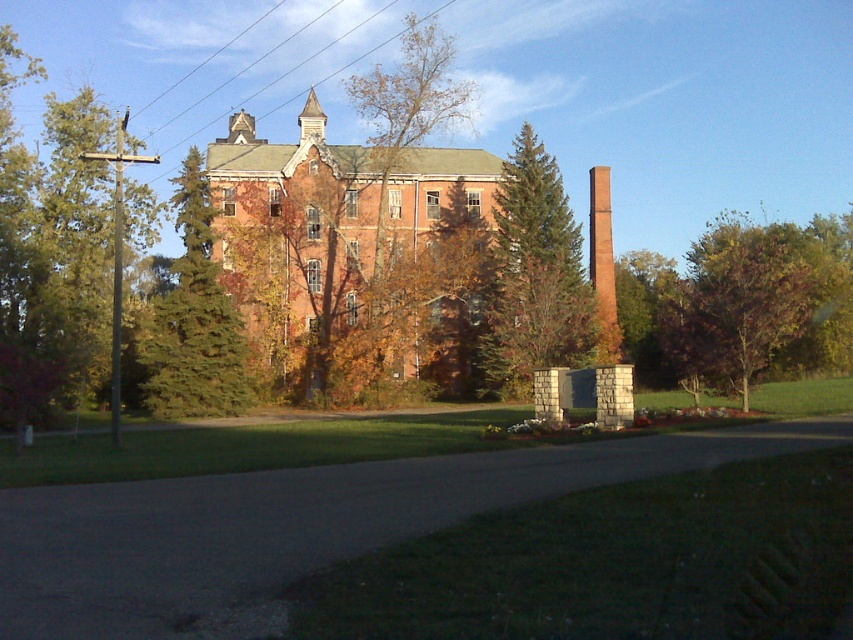
Question: Which point is farther from the camera taking this photo?

Choices:
 (A) (376, 182)
 (B) (35, 364)
 (C) (605, 269)

Answer: (C)

Question: Among these objects, which one is farthest from the camera?

Choices:
 (A) green textured pine tree at center
 (B) brown leafy tree at center
 (C) red brick chimney at center-right

Answer: (C)

Question: Which is farther from the brown leafy tree at center?

Choices:
 (A) brown wood utility pole at left
 (B) green textured pine tree at center
 (C) brick building at center

Answer: (A)

Question: Can you confirm if brown wood utility pole at left is positioned above brown leafy tree at center?

Choices:
 (A) no
 (B) yes

Answer: (A)

Question: Does green textured pine tree at center appear on the left side of purple leafy tree at right?

Choices:
 (A) no
 (B) yes

Answer: (B)

Question: In this image, where is brick building at center located relative to purple leafy tree at right?

Choices:
 (A) right
 (B) left

Answer: (B)